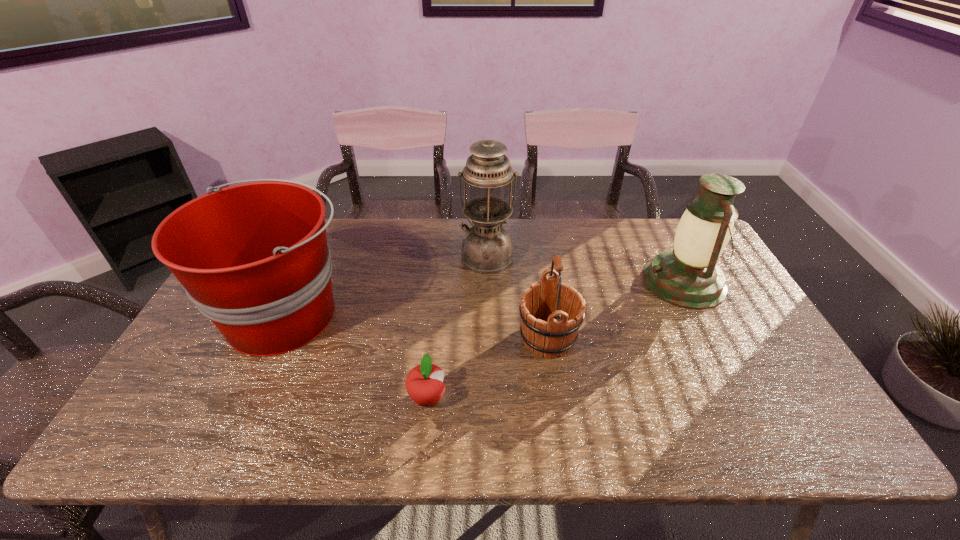
The height and width of the screenshot is (540, 960). What are the coordinates of `blank space at the near edge of the desktop` in the screenshot? It's located at (505, 428).

Locate an element on the screen. Image resolution: width=960 pixels, height=540 pixels. vacant space at the right edge of the desktop is located at coordinates (758, 343).

Identify the location of free spot at the near left corner of the desktop. (196, 444).

Image resolution: width=960 pixels, height=540 pixels. Find the location of `free space between the second shortest object and the bucket`. free space between the second shortest object and the bucket is located at coordinates (417, 326).

Find the location of a particular element. Image resolution: width=960 pixels, height=540 pixels. free spot between the oil lamp and the wine bucket is located at coordinates (517, 297).

Where is `unoccupied area between the second shortest object and the fourth object from right to left`? This screenshot has width=960, height=540. unoccupied area between the second shortest object and the fourth object from right to left is located at coordinates (488, 368).

The width and height of the screenshot is (960, 540). I want to click on free area in between the second shortest object and the oil lamp, so click(517, 297).

Where is `vacant space in between the rightmost object and the oil lamp`? The image size is (960, 540). vacant space in between the rightmost object and the oil lamp is located at coordinates (586, 269).

The width and height of the screenshot is (960, 540). Identify the location of vacant area that lies between the apple and the oil lamp. (457, 327).

The height and width of the screenshot is (540, 960). Identify the location of free space between the lantern and the leftmost object. (485, 298).